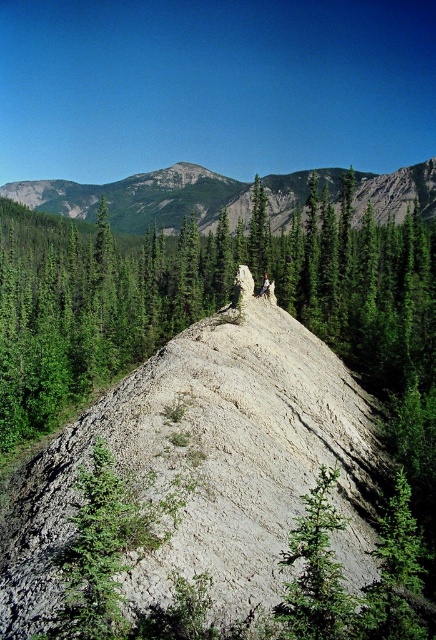
You are a hiker standing at the base of the steep sandy hill in the foreground. You see a point marked at coordinates (316, 572). What is the location of this point relative to the green rough textured tree at center?

The point at (316, 572) is located on the green rough textured tree at center.

You are a photographer planning to capture a landscape photo that includes both the green rough textured tree at center and the camouflage fabric hiker at center. Based on their sizes, which object should you focus on to ensure both fit in the frame without cropping?

The green rough textured tree at center has a larger width than the camouflage fabric hiker at center. To ensure both fit in the frame without cropping, focus on the green rough textured tree at center since it is wider and requires more space.